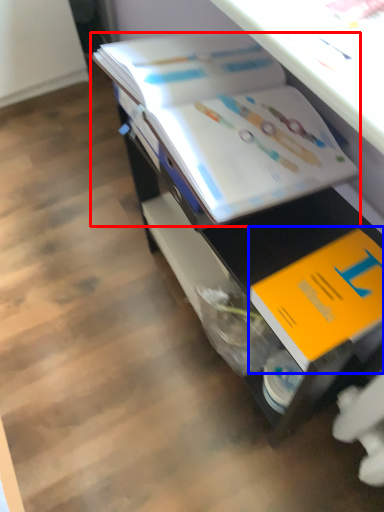
Question: Among these objects, which one is nearest to the camera, book (highlighted by a red box) or book (highlighted by a blue box)?

Choices:
 (A) book
 (B) book

Answer: (B)